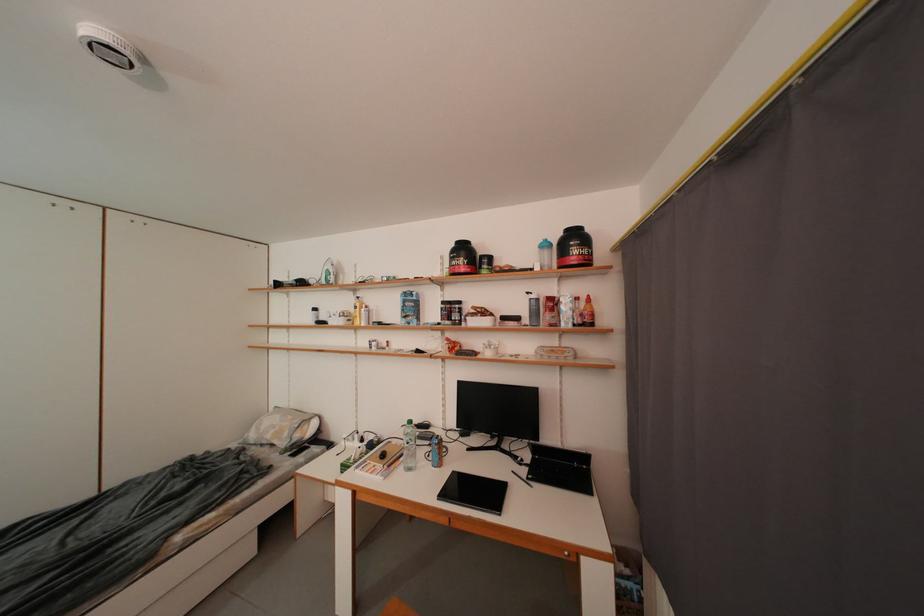
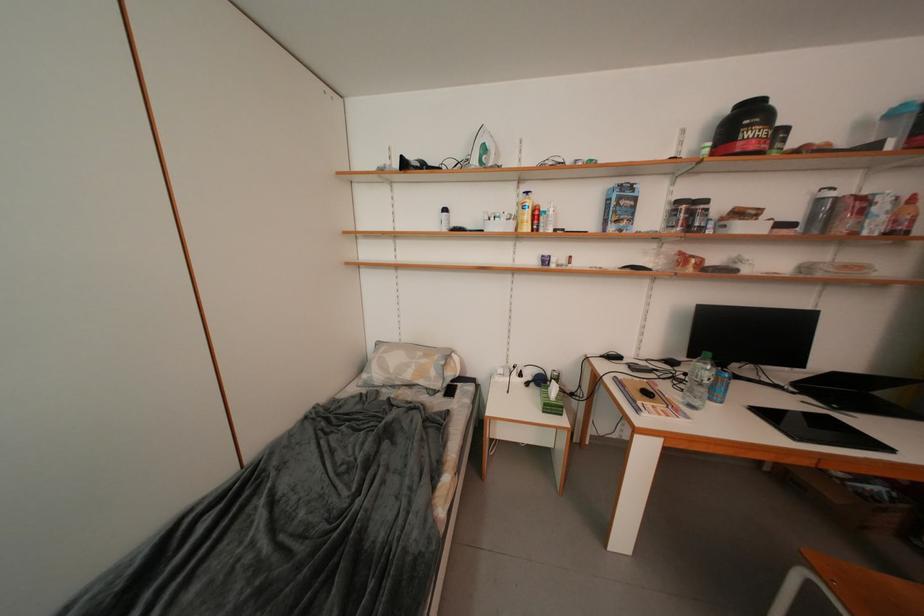
The images are taken continuously from a first-person perspective. In which direction are you moving?

The cameraman moved toward left, forward.